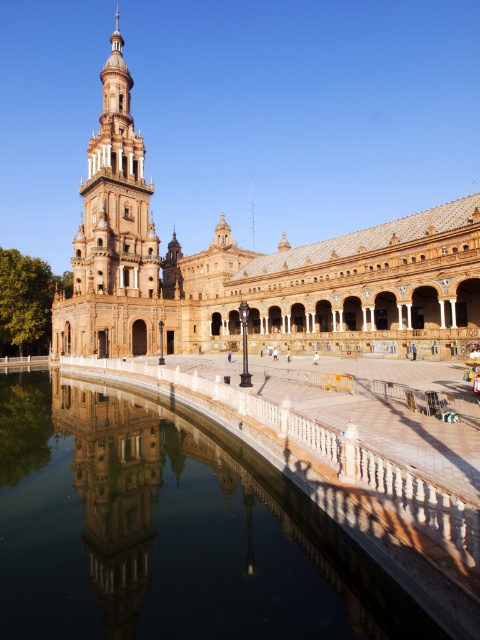
You are standing in front of the grand architectural structure. You notice the golden stone palace at left and the white stone tower at left. Which one is closer to you?

The golden stone palace at left is closer to you because it is in front of the white stone tower at left.

Based on the photo, you are standing in front of the grand architectural structure and notice the smooth reflective water at center and the golden stone palace at left. Which object is positioned lower in the scene?

The smooth reflective water at center is positioned lower than the golden stone palace at left as it is described to be below it.

You are standing in front of a historical building with a tall tower and a rectangular building with arched doorways. There is a point at coordinates point (140,320). Can you tell me how far this point is from you in meters?

The point (140,320) is 101.47 meters away from you.